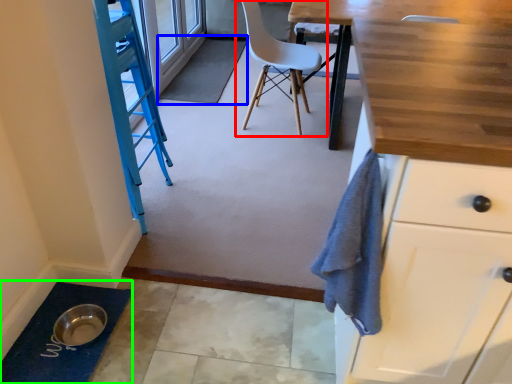
Question: Considering the real-world distances, which object is farthest from chair (highlighted by a red box)? bath mat (highlighted by a blue box) or bath mat (highlighted by a green box)?

Choices:
 (A) bath mat
 (B) bath mat

Answer: (B)